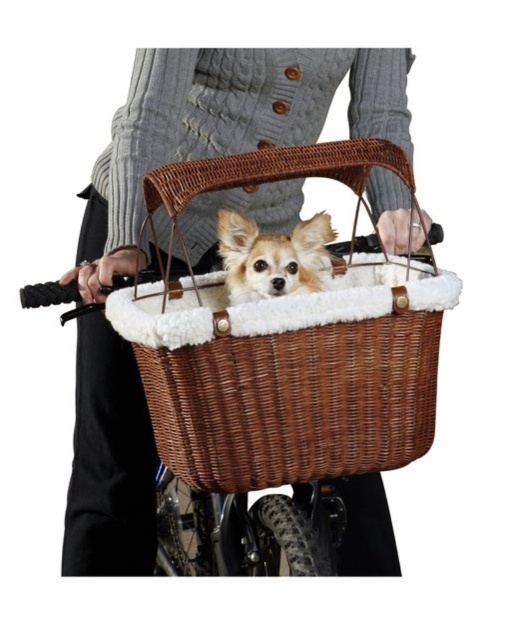
You are a photographer standing in front of the bicycle. You want to take a photo of the light brown fur dog at center and the woven brown basket at center. Which object should you focus on first if you want to capture both clearly in the same frame?

The woven brown basket at center is below the light brown fur dog at center, so you should focus on the light brown fur dog at center first to ensure both are in focus since it is closer to the camera.

You are a photographer trying to capture a closeup of the woven brown basket at center while standing in front of the camera. Can you get within 3 feet of the basket without moving the bicycle?

The woven brown basket at center and camera are 37.85 inches apart from each other. Since 37.85 inches is approximately 3.15 feet, you can get within 3 feet of the basket without moving the bicycle.

Based on the photo, you are a photographer trying to capture a clear shot of both the woven brown basket at center and the light brown fur dog at center. Since the dog is moving slightly, you need to adjust your focus. Which object should you focus on first to ensure both are in frame?

The woven brown basket at center is to the right of light brown fur dog at center. Focus on the light brown fur dog at center first, then adjust to include the basket to the right.